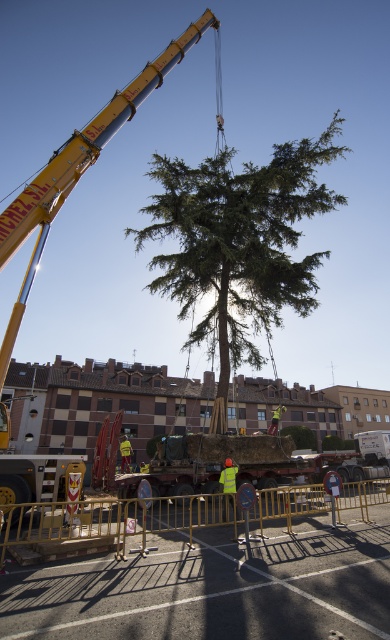
You are standing in front of the crane and looking at the two points marked on the image. Which point, point (223, 522) or point (232, 474), is closer to you?

Point (223, 522) is further to the camera than point (232, 474), so the point closer to you is point (232, 474).

Based on the photo, you are a pedestrian walking towards the gold metallic barricade at lower center and the yellow reflective vest at center. Which object will appear taller to you?

The gold metallic barricade at lower center has a greater height compared to the yellow reflective vest at center, so it will appear taller.